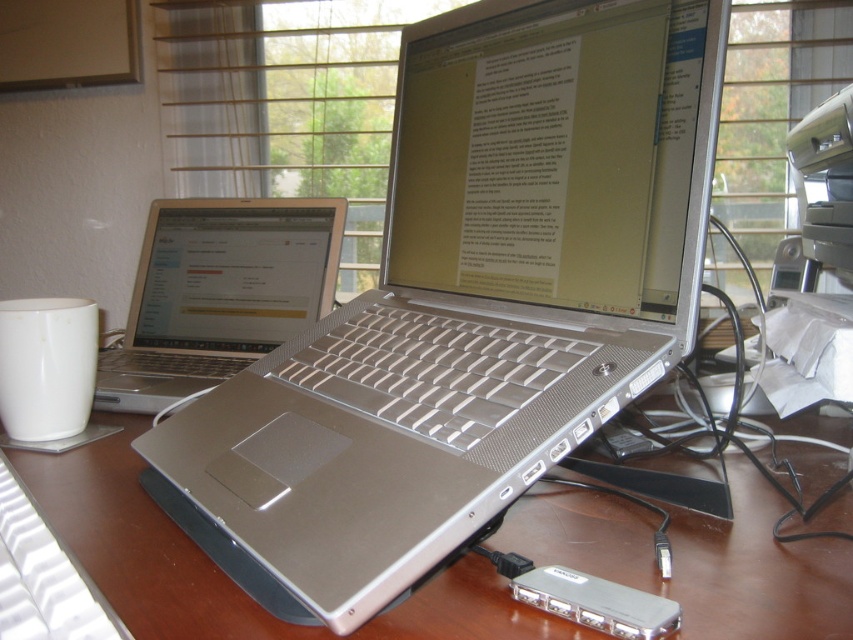
You are organizing your desk and need to place a new item between the white matte mug at left and the white plastic keyboard at lower left. Which object should you place the new item closer to if it needs to be near a larger object?

You should place the new item closer to the white matte mug at left because it has a larger size compared to the white plastic keyboard at lower left.

You are organizing the desk and want to place the white matte mug at left on the edge of the desk near the window. However, there is a white plastic keyboard at lower left in the way. Can you move the keyboard to make space for the mug?

The white plastic keyboard at lower left is behind the white matte mug at left, so you can move the keyboard to the side to create space for the mug.

You are organizing the desk and want to move the white plastic keyboard at lower left closer to the silver metallic laptop at left. However, you notice an object blocking the path. Which object is in the way?

The white plastic keyboard at lower left is behind the silver metallic laptop at left, so the silver metallic laptop at left is blocking the path.